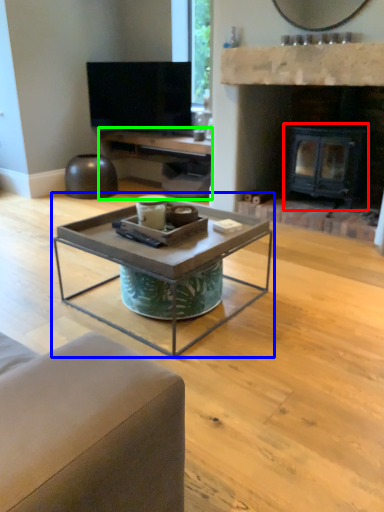
Question: Which object is the closest to the fireplace (highlighted by a red box)? Choose among these: coffee table (highlighted by a blue box) or entertainment center (highlighted by a green box).

Choices:
 (A) coffee table
 (B) entertainment center

Answer: (B)